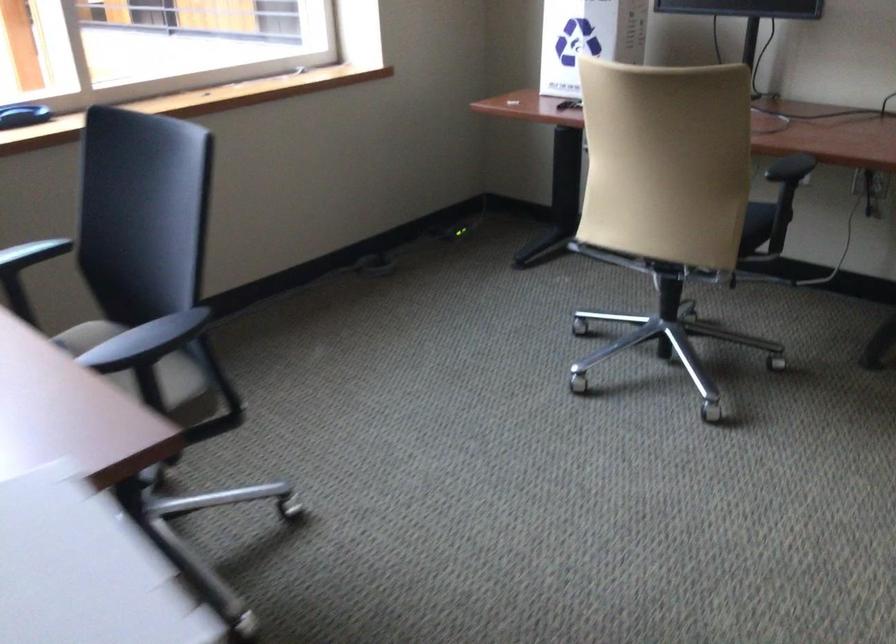
Identify the location of black chair armrest. The width and height of the screenshot is (896, 644). (31, 254).